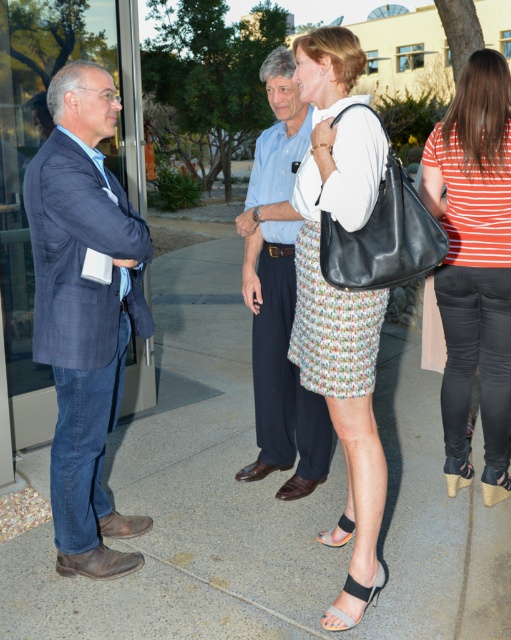
Based on the scene description, can you determine the spatial relationship between the white textured blouse at center and the black leather sandal at lower center?

The white textured blouse at center is located above the black leather sandal at lower center.

Based on the provided scene description, what are the coordinates of the blue denim jeans at left?

The coordinates of the blue denim jeans at left are at point (84, 312).

You are a photographer setting up a tripod to capture a group shot of the blue denim jeans at left and the white textured blouse at center. The tripod requires a minimum distance of 30 inches between subjects to focus properly. Based on the scene, will the tripod be able to focus on both subjects?

The blue denim jeans at left is 35.84 inches away from the white textured blouse at center, which is more than the required 30 inches. Therefore, the tripod can focus on both subjects.